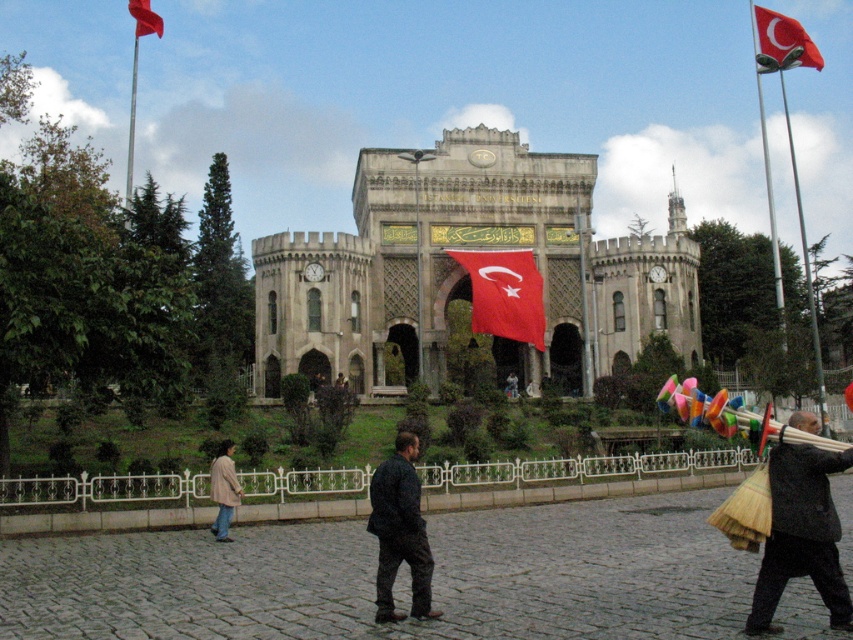
You are standing at the entrance of the historic Ottoman building and notice a dark gray wool coat at lower right. Based on its position, can you estimate how close it is to the central archway?

The dark gray wool coat at lower right is located at point (x=801, y=534), which suggests it is positioned near the lower right corner of the scene, farther from the central archway. Therefore, it is not very close to the central archway.

You are a visitor standing at the entrance of the historic Ottoman building. You notice a light beige coat at lower left and a red fabric flag at upper left. If you want to retrieve your coat without moving closer to the red fabric flag, which direction should you move?

To retrieve the light beige coat at lower left without moving closer to the red fabric flag at upper left, you should move towards the lower left direction, as the coat is located there and moving in that direction would keep you away from the flag at upper left.